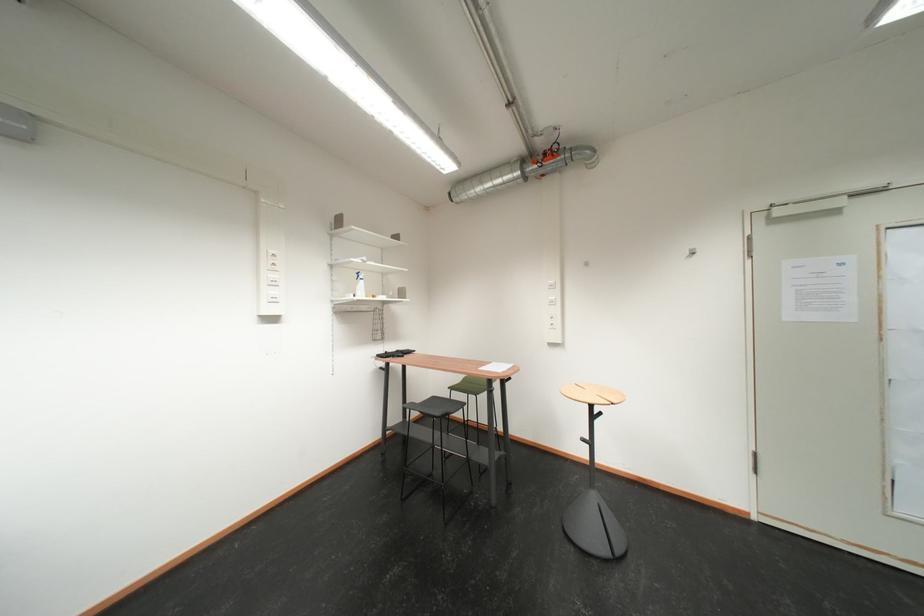
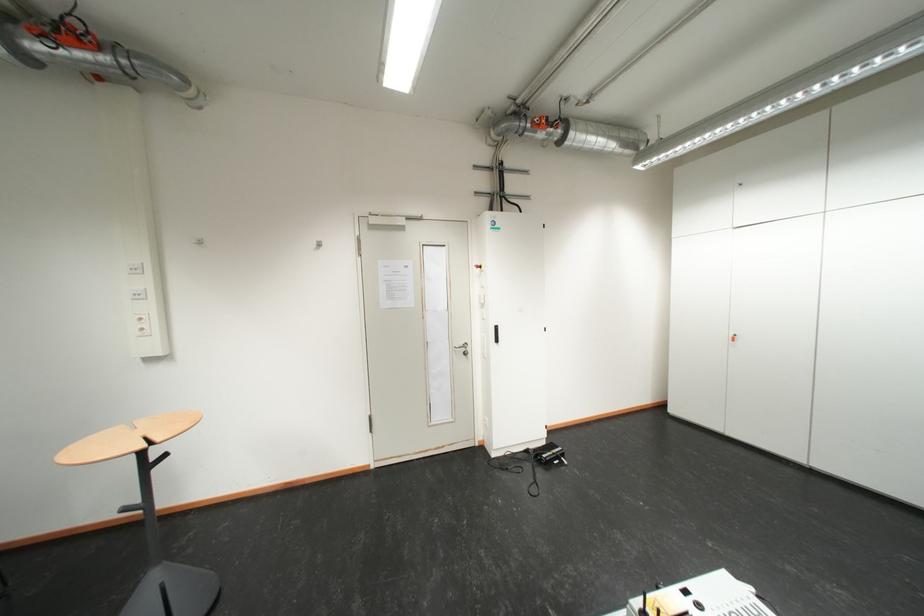
The point at [562,288] is marked in the first image. Where is the corresponding point in the second image?

(144, 272)